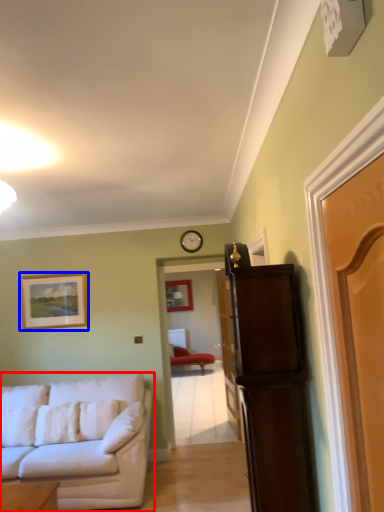
Question: Which point is closer to the camera, studio couch (highlighted by a red box) or picture frame (highlighted by a blue box)?

Choices:
 (A) studio couch
 (B) picture frame

Answer: (A)